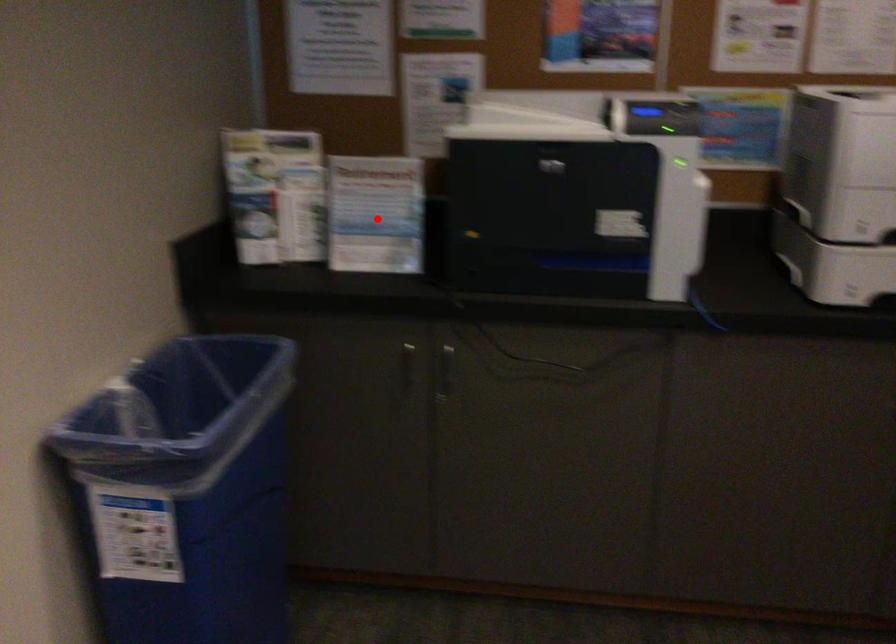
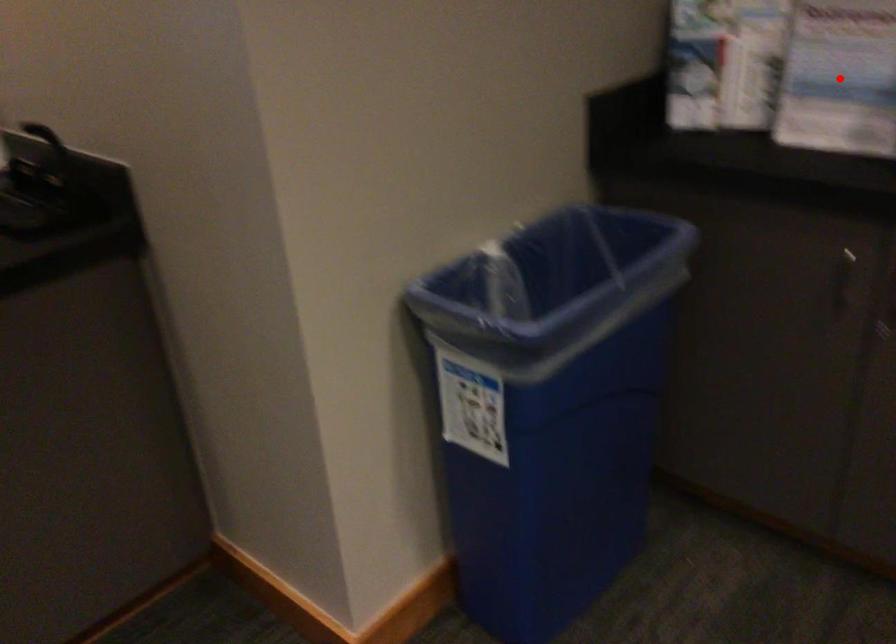
I am providing you with two images of the same scene from different viewpoints. A red point is marked on the first image and another point is marked on the second image. Are the points marked in image1 and image2 representing the same 3D position?

Yes